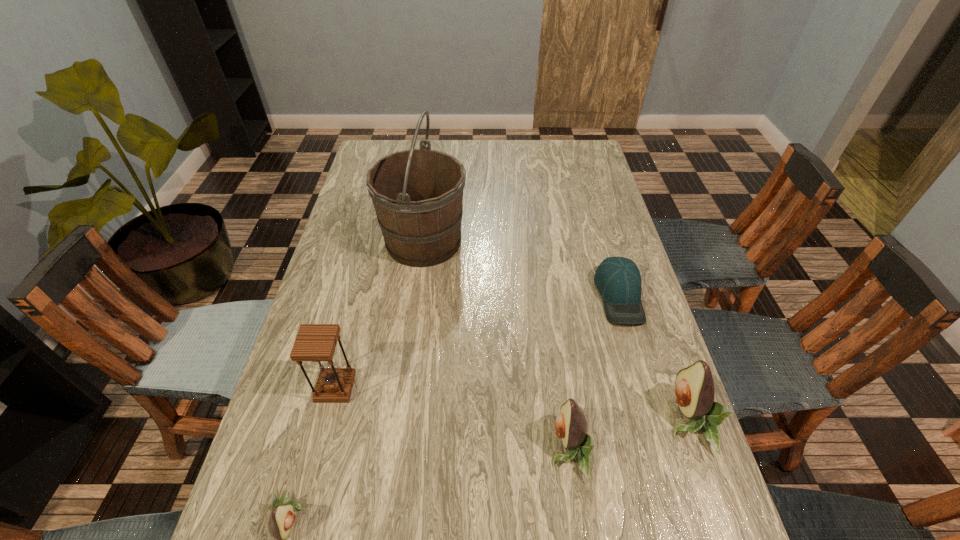
Locate an element on the screen. The height and width of the screenshot is (540, 960). free space at the far edge of the desktop is located at coordinates (496, 160).

In the image, there is a desktop. At what (x,y) coordinates should I click in order to perform the action: click on vacant space at the near edge. Please return your answer as a coordinate pair (x, y). Looking at the image, I should click on (617, 510).

In the image, there is a desktop. Find the location of `vacant space at the left edge`. vacant space at the left edge is located at coordinates (330, 279).

Image resolution: width=960 pixels, height=540 pixels. I want to click on free location at the right edge, so click(649, 334).

I want to click on vacant space at the near left corner of the desktop, so click(320, 483).

This screenshot has height=540, width=960. What are the coordinates of `vacant area at the far right corner` in the screenshot? It's located at (590, 158).

The image size is (960, 540). I want to click on unoccupied position between the tallest object and the rightmost avocado, so click(556, 330).

At what (x,y) coordinates should I click in order to perform the action: click on free space between the second avocado from left to right and the shortest object. Please return your answer as a coordinate pair (x, y). The height and width of the screenshot is (540, 960). Looking at the image, I should click on (594, 373).

You are a GUI agent. You are given a task and a screenshot of the screen. Output one action in this format:
    pyautogui.click(x=<x>, y=<y>)
    Task: Click on the free area in between the second shortest avocado and the rightmost avocado
    
    Given the screenshot: What is the action you would take?
    pyautogui.click(x=628, y=435)

In order to click on vacant space in between the second avocado from left to right and the bucket in this screenshot , I will do (x=496, y=346).